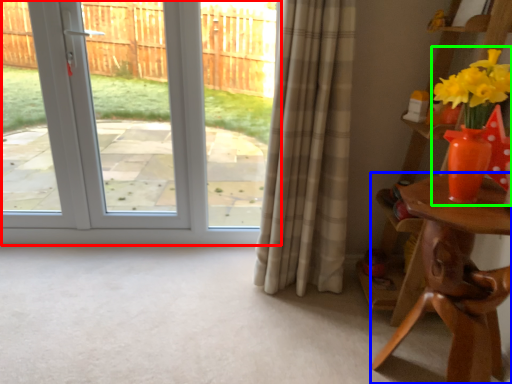
Question: Which object is positioned farthest from door (highlighted by a red box)? Select from table (highlighted by a blue box) and floral arrangement (highlighted by a green box).

Choices:
 (A) table
 (B) floral arrangement

Answer: (B)